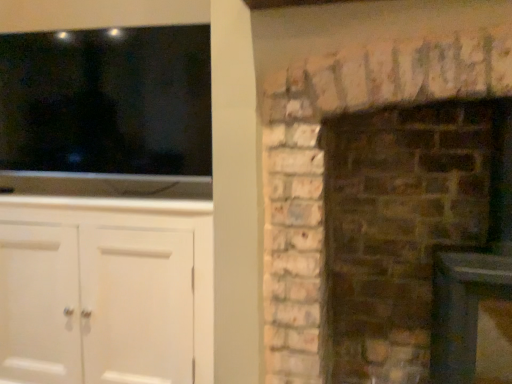
Question: Considering the positions of black glossy tv at upper left and white painted wood cabinet at left in the image, is black glossy tv at upper left wider or thinner than white painted wood cabinet at left?

Choices:
 (A) thin
 (B) wide

Answer: (A)

Question: In the image, is black glossy tv at upper left positioned in front of or behind white painted wood cabinet at left?

Choices:
 (A) front
 (B) behind

Answer: (B)

Question: Considering the real-world distances, which object is closest to the brown brick fireplace at right?

Choices:
 (A) black glossy tv at upper left
 (B) white painted wood cabinet at left

Answer: (B)

Question: Considering the real-world distances, which object is closest to the white painted wood cabinet at left?

Choices:
 (A) black glossy tv at upper left
 (B) brown brick fireplace at right

Answer: (A)